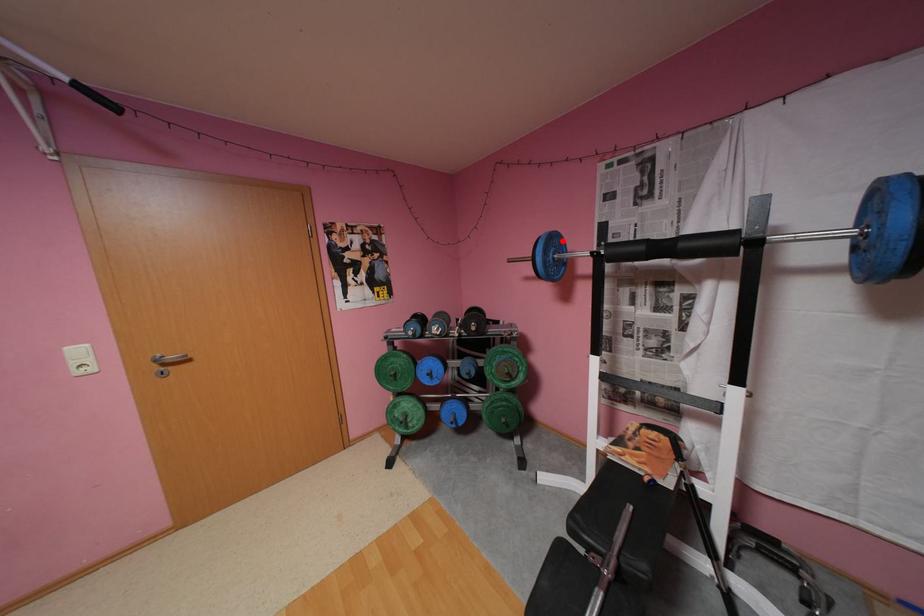
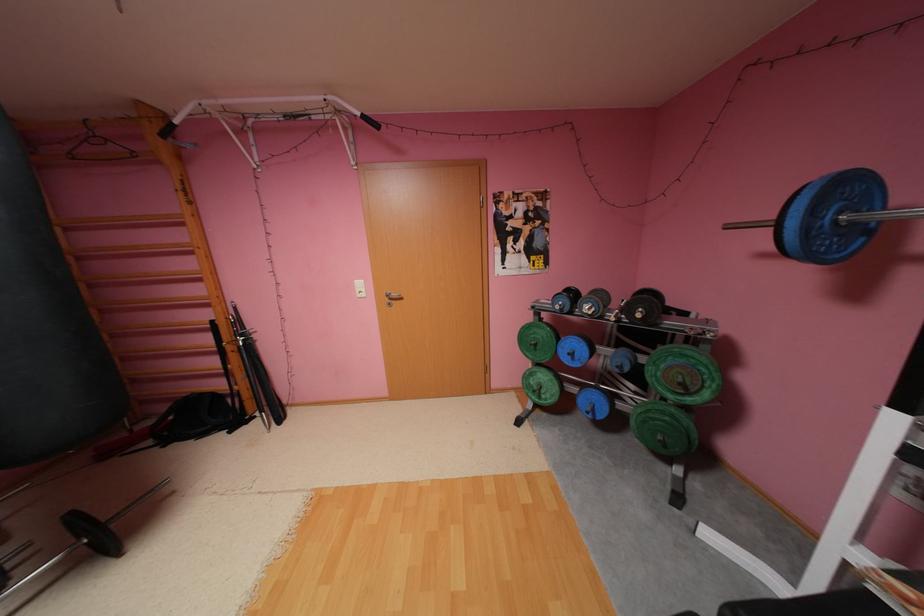
Question: I am providing you with two images of the same scene from different viewpoints. Image1 has a red point marked. In image2, the corresponding 3D location appears at what relative position? Reply with the corresponding letter.

Choices:
 (A) Closer
 (B) Farther

Answer: (B)